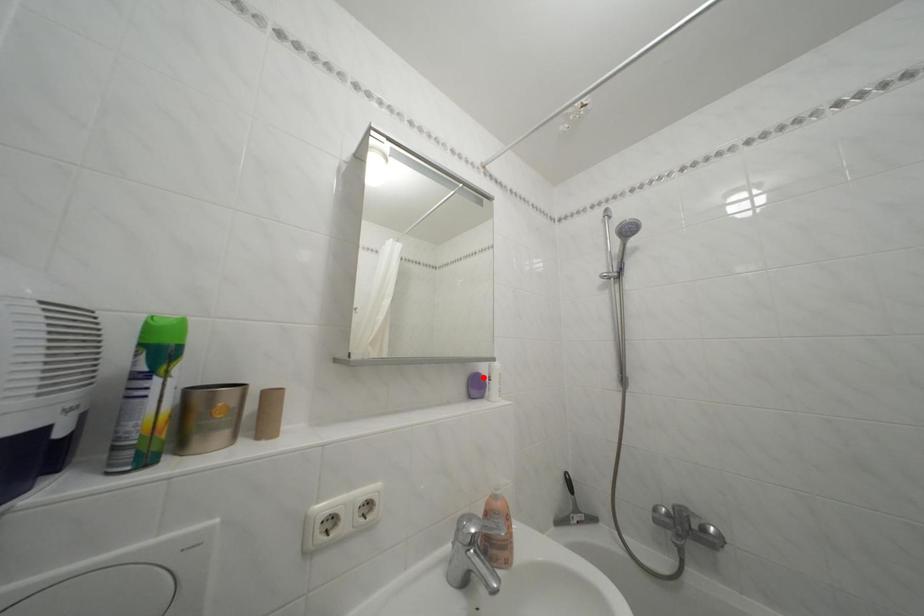
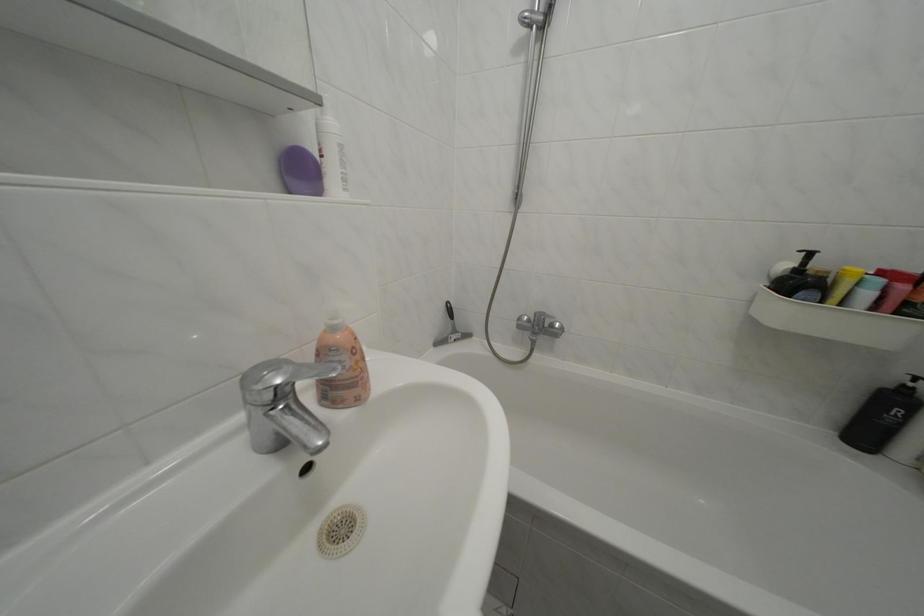
Question: I am providing you with two images of the same scene from different viewpoints. A red point is marked on the first image. At the location where the point appears in image 1, is it still visible in image 2?

Choices:
 (A) Yes
 (B) No

Answer: (A)